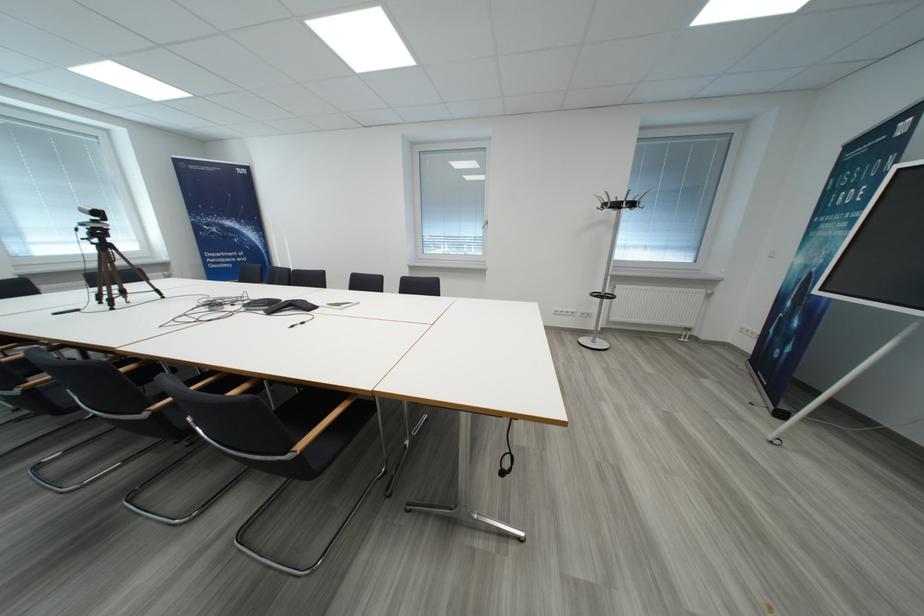
The width and height of the screenshot is (924, 616). What do you see at coordinates (621, 201) in the screenshot?
I see `a coat rack hook` at bounding box center [621, 201].